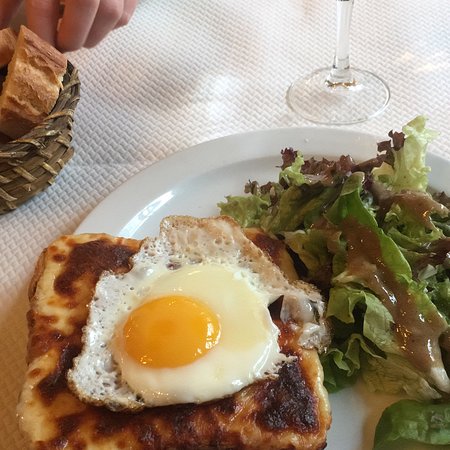
Identify the location of glass base. Image resolution: width=450 pixels, height=450 pixels. (361, 101).